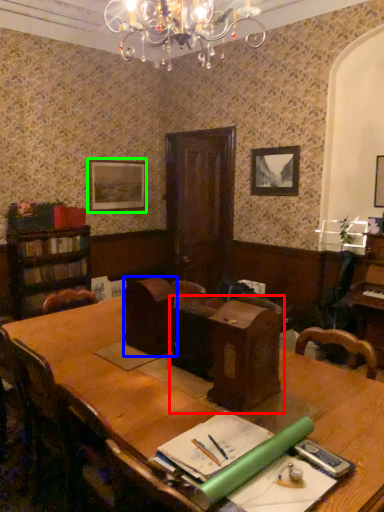
Question: Which object is the farthest from computer desk (highlighted by a red box)? Choose among these: armchair (highlighted by a blue box) or picture frame (highlighted by a green box).

Choices:
 (A) armchair
 (B) picture frame

Answer: (B)